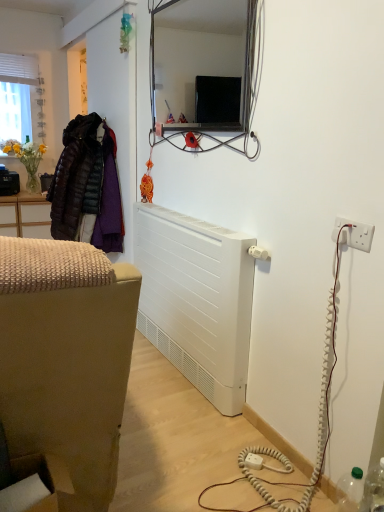
Question: Can you confirm if transparent plastic bottle at lower right is positioned to the left of white plastic electrical outlet at right?

Choices:
 (A) no
 (B) yes

Answer: (A)

Question: From the image's perspective, does transparent plastic bottle at lower right appear higher than white plastic electrical outlet at right?

Choices:
 (A) no
 (B) yes

Answer: (A)

Question: Are transparent plastic bottle at lower right and white plastic electrical outlet at right beside each other?

Choices:
 (A) no
 (B) yes

Answer: (A)

Question: Does transparent plastic bottle at lower right have a lesser height compared to white plastic electrical outlet at right?

Choices:
 (A) no
 (B) yes

Answer: (A)

Question: Is there a large distance between transparent plastic bottle at lower right and white plastic electrical outlet at right?

Choices:
 (A) yes
 (B) no

Answer: (B)

Question: From the image's perspective, is transparent plastic bottle at lower right above or below white plastic electrical outlet at right?

Choices:
 (A) below
 (B) above

Answer: (A)

Question: From a real-world perspective, is transparent plastic bottle at lower right physically located above or below white plastic electrical outlet at right?

Choices:
 (A) above
 (B) below

Answer: (B)

Question: Is transparent plastic bottle at lower right inside or outside of white plastic electrical outlet at right?

Choices:
 (A) inside
 (B) outside

Answer: (B)

Question: In terms of height, does transparent plastic bottle at lower right look taller or shorter compared to white plastic electrical outlet at right?

Choices:
 (A) short
 (B) tall

Answer: (B)

Question: From a real-world perspective, is white matte radiator at lower center above or below white plastic electrical outlet at right?

Choices:
 (A) above
 (B) below

Answer: (B)

Question: Is point (198, 262) closer or farther from the camera than point (352, 237)?

Choices:
 (A) farther
 (B) closer

Answer: (A)

Question: From their relative heights in the image, would you say white matte radiator at lower center is taller or shorter than white plastic electrical outlet at right?

Choices:
 (A) short
 (B) tall

Answer: (B)

Question: Relative to white plastic electrical outlet at right, is white matte radiator at lower center in front or behind?

Choices:
 (A) behind
 (B) front

Answer: (A)

Question: Is dark brown quilted jacket at left bigger or smaller than metallic frame mirror at upper center?

Choices:
 (A) big
 (B) small

Answer: (A)

Question: Does point (71, 123) appear closer or farther from the camera than point (238, 52)?

Choices:
 (A) farther
 (B) closer

Answer: (B)